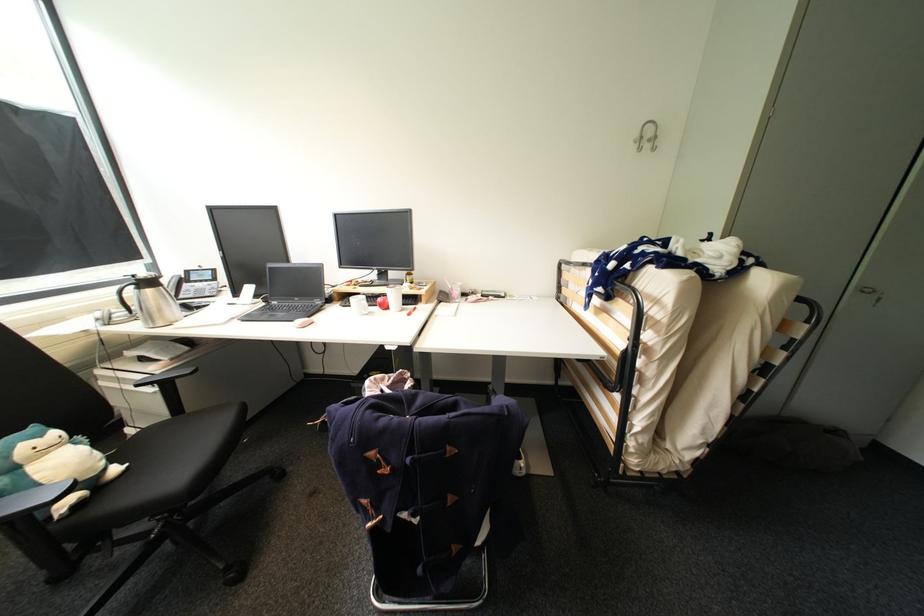
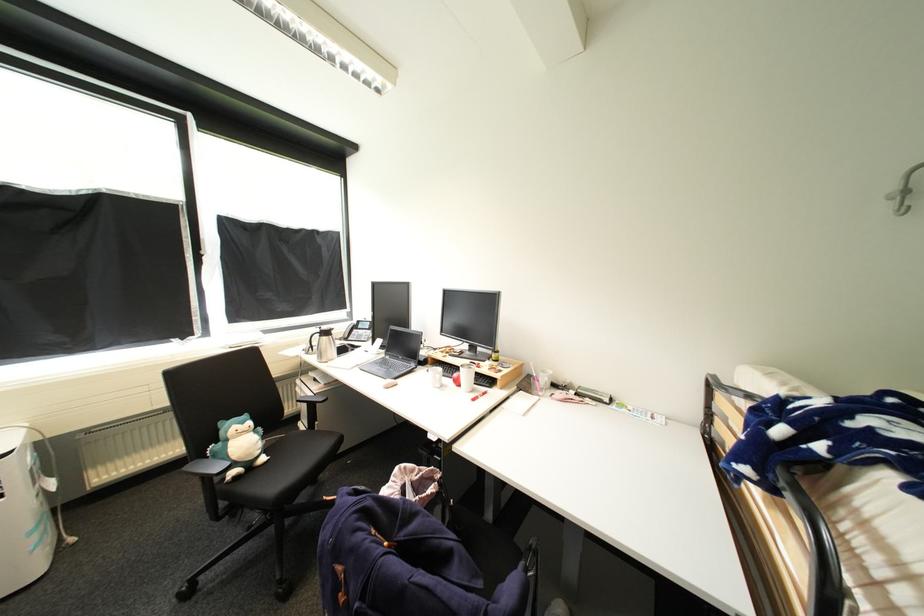
Where in the second image is the point corresponding to (342,302) from the first image?

(434, 366)